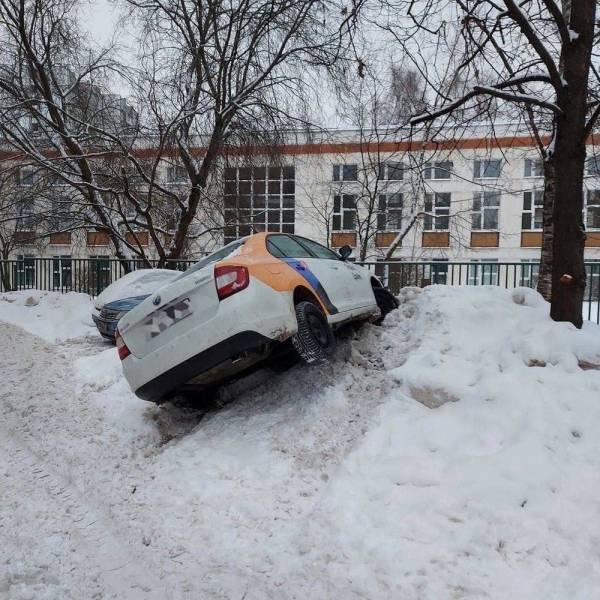
You are a GUI agent. You are given a task and a screenshot of the screen. Output one action in this format:
    pyautogui.click(x=<x>, y=<y>)
    Task: Click on the windows
    
    Given the screenshot: What is the action you would take?
    pyautogui.click(x=290, y=252)